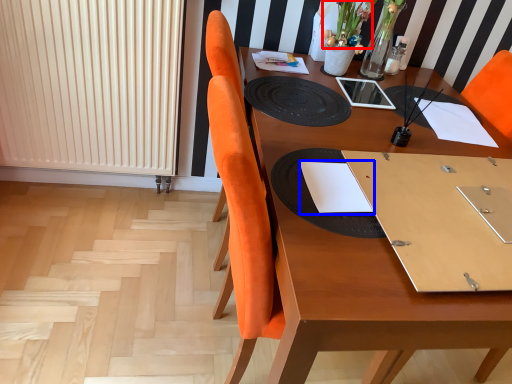
Question: Which of the following is the closest to the observer, flower (highlighted by a red box) or notebook (highlighted by a blue box)?

Choices:
 (A) flower
 (B) notebook

Answer: (B)